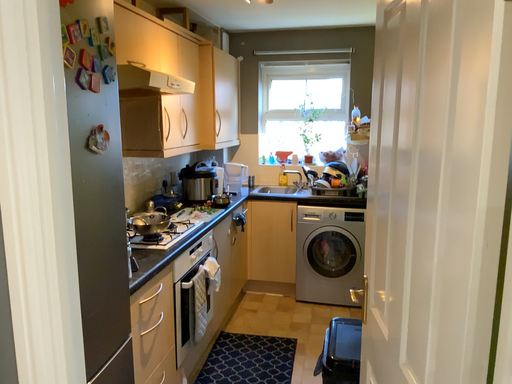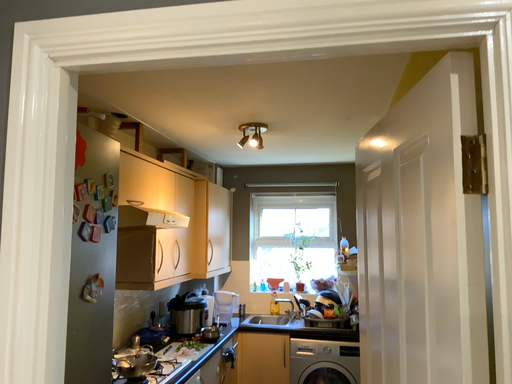
Question: Which way did the camera rotate in the video?

Choices:
 (A) rotated downward
 (B) rotated upward

Answer: (B)